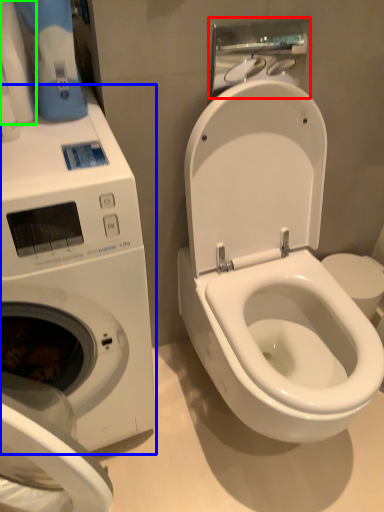
Question: Estimate the real-world distances between objects in this image. Which object is farther from hand dryer (highlighted by a red box), washing machine (highlighted by a blue box) or toilet paper (highlighted by a green box)?

Choices:
 (A) washing machine
 (B) toilet paper

Answer: (A)